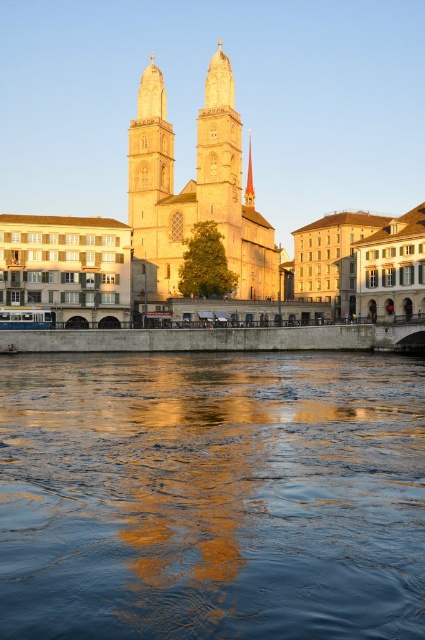
You are standing at the point with coordinates point (195, 189) in the image. What structure are you facing?

The point (195, 189) indicates the golden stone tower at center, so you are facing the golden stone tower at center.

You are an architect examining the church design. Based on the scene, which object, the golden stone tower at center or the gold polished spire at center, has a larger base width?

The golden stone tower at center is wider than the gold polished spire at center according to the description.

You are a tourist standing in front of the historic church and want to take a photo that includes both the golden stone tower at center and the gold polished spire at center. Since you have a wide angle lens, which object should you focus on to ensure both are in frame?

The golden stone tower at center is much taller than the gold polished spire at center, so focusing on the golden stone tower at center will ensure both are in frame.